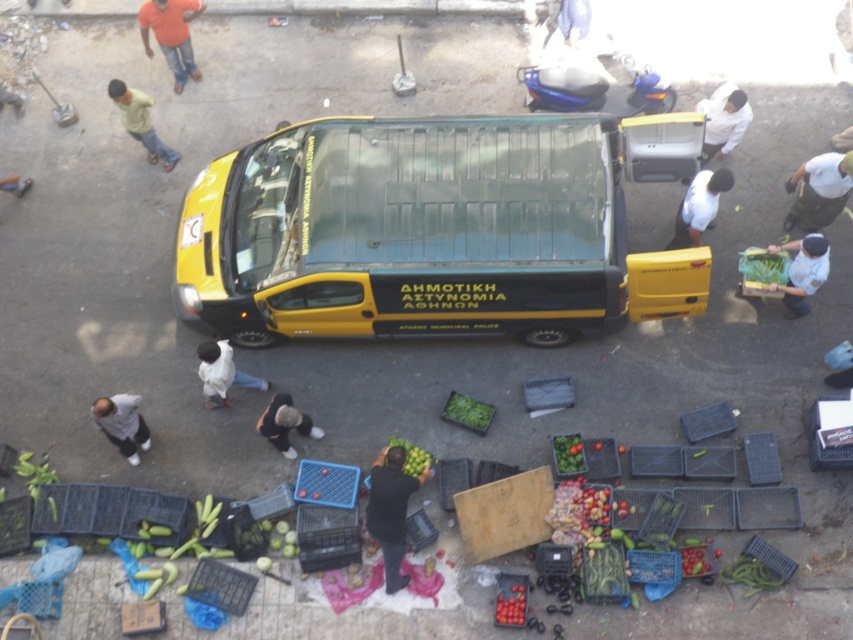
You are a photographer trying to capture a candid shot of the dark blue jeans at center and the white cotton shirt at upper right. Since you want to ensure both subjects are in focus, you need to know which one is taller. Can you determine which of the two is taller?

The dark blue jeans at center is taller than the white cotton shirt at upper right, so you should adjust your camera settings to focus on the taller subject first.

You are a delivery person who needs to place a package on the green matte cucumber at lower right. The package must be placed to the right of the dark blue jeans at center. Is this possible given their positions?

Yes, because the dark blue jeans at center are already positioned to the left of the green matte cucumber at lower right, so placing the package to the right of the dark blue jeans at center would align with the required placement next to the cucumber.

You are a delivery person who needs to place a 2.5 meter long ladder between the dark blue jeans at center and the green matte cucumber at lower right. Can the ladder fit between them without bending?

The distance between the dark blue jeans at center and the green matte cucumber at lower right is 3.38 meters. Since the ladder is 2.5 meters long, it can fit between them without bending as there is enough space.